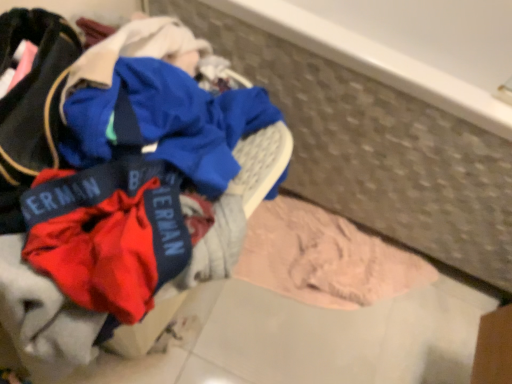
This screenshot has height=384, width=512. In order to click on free point above pink soft fabric at lower right (from a real-world perspective) in this screenshot , I will do `click(360, 286)`.